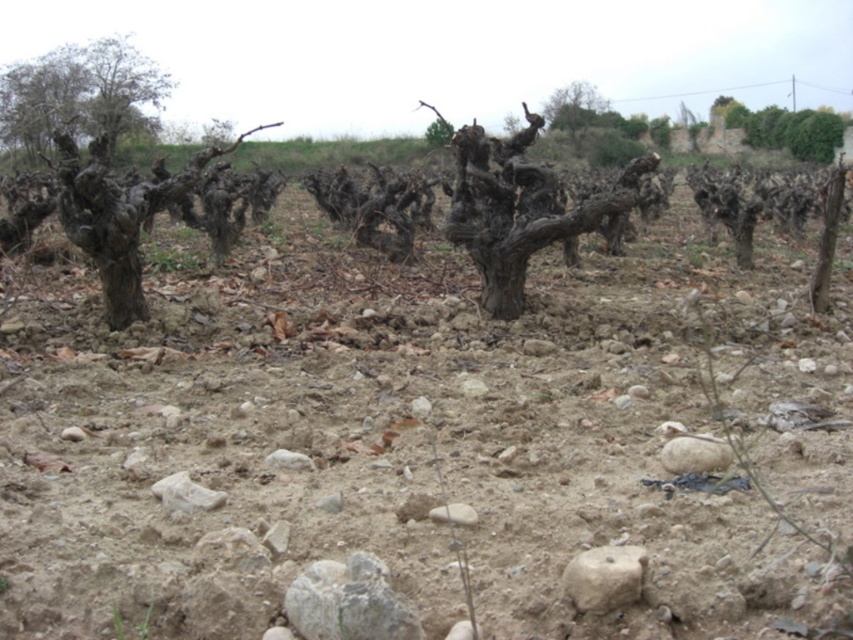
How far apart are gray rough bark tree at center and gray rough rock at center?

They are 4.29 meters apart.

Between gray rough bark tree at center and gray rough rock at center, which one appears on the right side from the viewer's perspective?

gray rough bark tree at center is more to the right.

Is point (518, 176) positioned after point (628, 573)?

Yes, point (518, 176) is farther from viewer.

Locate an element on the screen. The height and width of the screenshot is (640, 853). gray rough bark tree at center is located at coordinates (519, 209).

Can you confirm if gray rough bark tree at center is positioned below white smooth rock at center?

Incorrect, gray rough bark tree at center is not positioned below white smooth rock at center.

Can you confirm if gray rough bark tree at center is taller than white smooth rock at center?

Indeed, gray rough bark tree at center has a greater height compared to white smooth rock at center.

Describe the element at coordinates (519, 209) in the screenshot. This screenshot has width=853, height=640. I see `gray rough bark tree at center` at that location.

Identify the location of gray rough bark tree at center. [x=519, y=209].

Who is positioned more to the right, dark brown bark tree at left or green leafy bush at upper right?

green leafy bush at upper right

Can you confirm if dark brown bark tree at left is bigger than green leafy bush at upper right?

Yes.

Between point (68, 240) and point (833, 136), which one is positioned behind?

Positioned behind is point (833, 136).

Locate an element on the screen. This screenshot has width=853, height=640. dark brown bark tree at left is located at coordinates (97, 154).